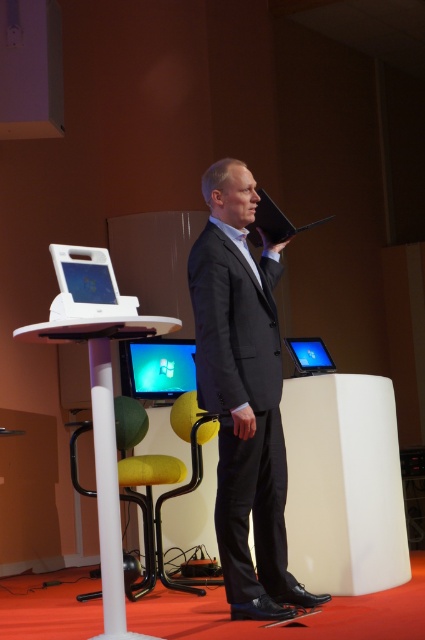
Question: Does dark gray suit at center have a smaller size compared to matte black laptop at center?

Choices:
 (A) no
 (B) yes

Answer: (A)

Question: Among these points, which one is farthest from the camera?

Choices:
 (A) (234, 582)
 (B) (263, 200)
 (C) (107, 336)
 (D) (166, 493)

Answer: (D)

Question: Can you confirm if dark gray suit at center is positioned above black glossy laptop at upper center?

Choices:
 (A) yes
 (B) no

Answer: (B)

Question: Among these objects, which one is nearest to the camera?

Choices:
 (A) white glossy podium at center
 (B) black glossy laptop at upper center
 (C) matte black laptop at center
 (D) white plastic laptop at center

Answer: (A)

Question: Which object is positioned closest to the matte black laptop at center?

Choices:
 (A) dark gray suit at center
 (B) white plastic laptop at center

Answer: (A)

Question: Is black glossy laptop at upper center in front of matte black laptop at center?

Choices:
 (A) no
 (B) yes

Answer: (B)